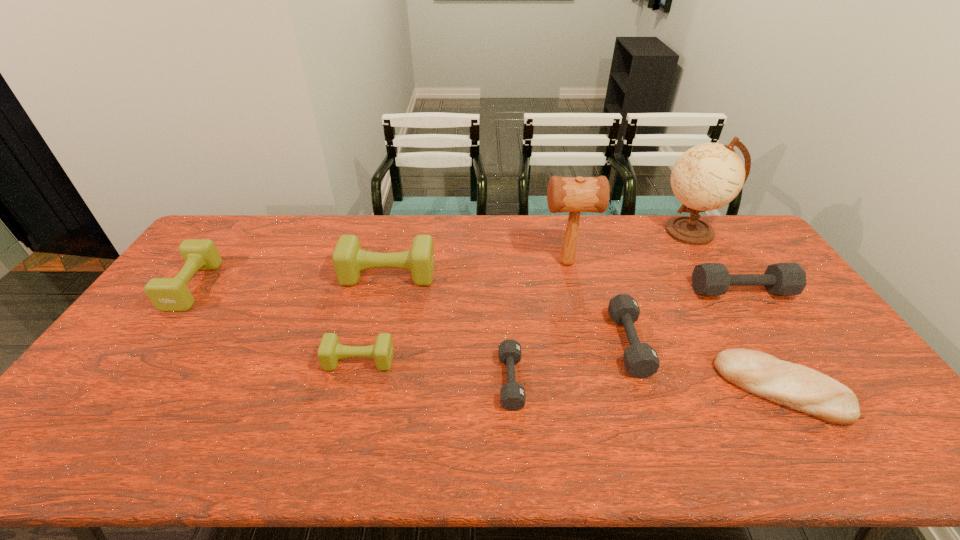
Where is `vacant space located on the strike surface of the mallet`? This screenshot has width=960, height=540. vacant space located on the strike surface of the mallet is located at coordinates (431, 263).

Where is `vacant area situated on the front of the biggest olive dumbbell`? The width and height of the screenshot is (960, 540). vacant area situated on the front of the biggest olive dumbbell is located at coordinates (372, 341).

Where is `vacant space located 0.260m on the back of the leftmost object`? vacant space located 0.260m on the back of the leftmost object is located at coordinates (241, 220).

Locate an element on the screen. The image size is (960, 540). free space located 0.150m on the front of the farthest gray dumbbell is located at coordinates (773, 340).

The height and width of the screenshot is (540, 960). Find the location of `vacant space located on the left of the second biggest gray dumbbell`. vacant space located on the left of the second biggest gray dumbbell is located at coordinates pyautogui.click(x=525, y=343).

Locate an element on the screen. The width and height of the screenshot is (960, 540). blank area located on the right of the nearest olive dumbbell is located at coordinates (422, 361).

What are the coordinates of `vacant space situated on the back of the bread` in the screenshot? It's located at (710, 273).

Find the location of a particular element. vacant space located on the back of the fourth dumbbell from left to right is located at coordinates (505, 294).

Where is `globe located in the far edge section of the desktop`? globe located in the far edge section of the desktop is located at coordinates pyautogui.click(x=708, y=176).

At what (x,y) coordinates should I click in order to perform the action: click on mallet positioned at the far edge. Please return your answer as a coordinate pair (x, y). Looking at the image, I should click on (579, 194).